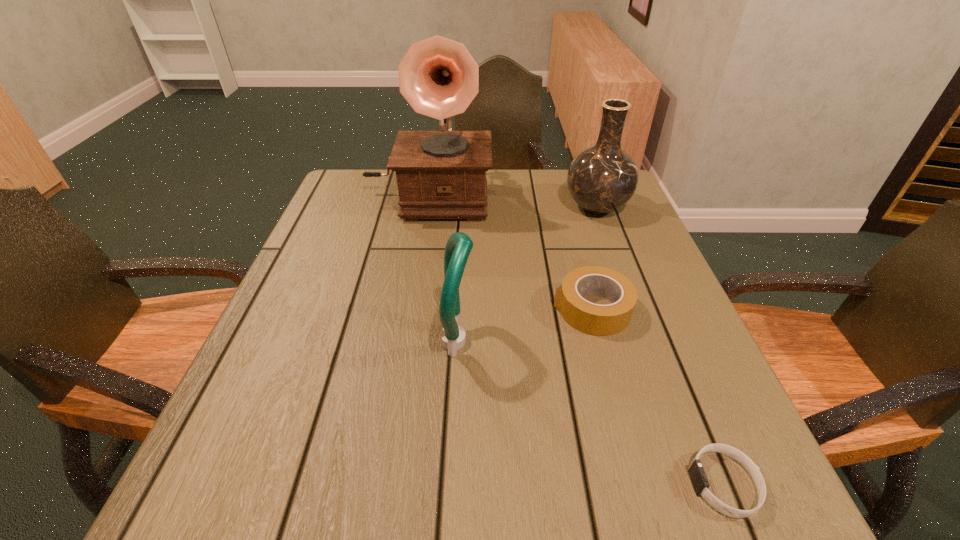
This screenshot has width=960, height=540. What are the coordinates of `vacant space located at the edge of the fourth tallest object` in the screenshot? It's located at (428, 309).

Find the location of `vacant space located 0.100m at the edge of the fourth tallest object`. vacant space located 0.100m at the edge of the fourth tallest object is located at coordinates (504, 309).

Image resolution: width=960 pixels, height=540 pixels. In order to click on free space located 0.360m on the outer surface of the shortest object in this screenshot , I will do `click(435, 484)`.

At what (x,y) coordinates should I click in order to perform the action: click on free spot located on the outer surface of the shortest object. Please return your answer as a coordinate pair (x, y). This screenshot has height=540, width=960. Looking at the image, I should click on (485, 484).

Image resolution: width=960 pixels, height=540 pixels. I want to click on vacant region located on the outer surface of the shortest object, so click(x=427, y=484).

Find the location of `record player present at the far edge`. record player present at the far edge is located at coordinates (441, 174).

Where is `vase present at the far edge`? vase present at the far edge is located at coordinates (601, 179).

Where is `object that is at the near edge`? This screenshot has width=960, height=540. object that is at the near edge is located at coordinates (697, 474).

At what (x,y) coordinates should I click in order to perform the action: click on object at the left edge. Please return your answer as a coordinate pair (x, y). Looking at the image, I should click on (441, 174).

Find the location of a particular element. This screenshot has width=960, height=540. vase at the right edge is located at coordinates (601, 179).